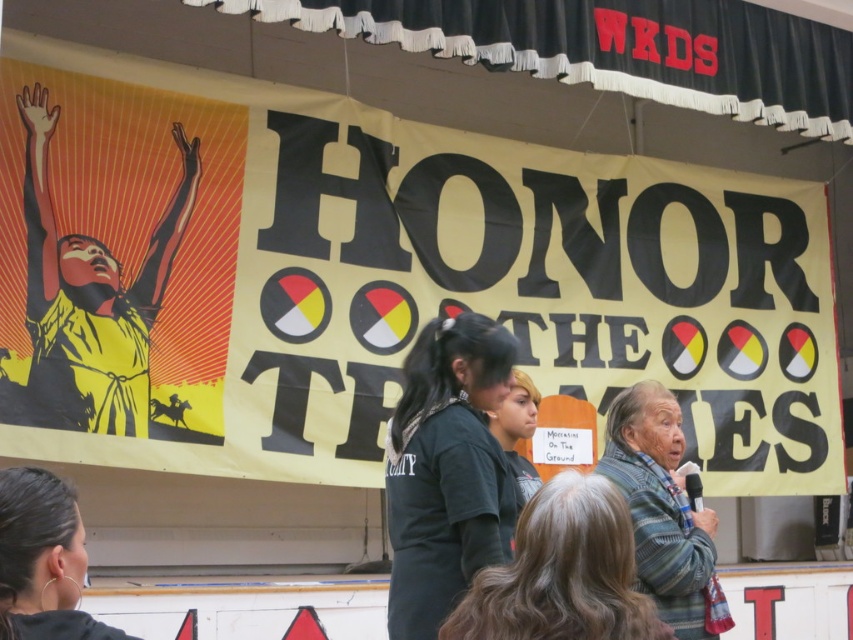
Question: Is yellow matte poster at center to the left of gray hair at lower center from the viewer's perspective?

Choices:
 (A) no
 (B) yes

Answer: (B)

Question: Which point is farther to the camera?

Choices:
 (A) (425, 605)
 (B) (605, 572)
 (C) (77, 596)

Answer: (A)

Question: Can you confirm if black matte shirt at center is positioned to the left of gray hair at lower center?

Choices:
 (A) yes
 (B) no

Answer: (A)

Question: Does yellow matte poster at center appear over black matte shirt at center?

Choices:
 (A) yes
 (B) no

Answer: (A)

Question: Among these points, which one is nearest to the camera?

Choices:
 (A) (521, 557)
 (B) (9, 449)

Answer: (A)

Question: Considering the real-world distances, which object is farthest from the black matte shirt at center?

Choices:
 (A) gray hair at lower center
 (B) yellow matte poster at center
 (C) matte black shirt at lower left

Answer: (B)